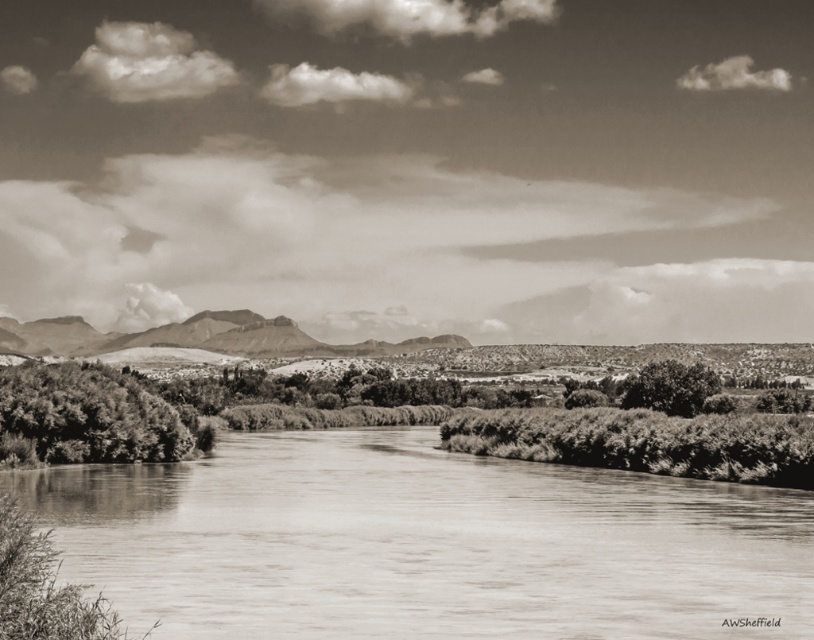
Question: Does smooth water at center have a lesser width compared to thick foliage at left?

Choices:
 (A) yes
 (B) no

Answer: (B)

Question: Which point is closer to the camera taking this photo?

Choices:
 (A) (624, 403)
 (B) (191, 438)

Answer: (B)

Question: Considering the real-world distances, which object is farthest from the thick foliage at left?

Choices:
 (A) grainy textured bush at right
 (B) smooth water at center

Answer: (A)

Question: Can you confirm if smooth water at center is thinner than rugged stone mountain at center?

Choices:
 (A) no
 (B) yes

Answer: (B)

Question: Among these objects, which one is farthest from the camera?

Choices:
 (A) rugged stone mountain at center
 (B) smooth water at center

Answer: (A)

Question: Does smooth water at center have a lesser width compared to grainy textured bush at right?

Choices:
 (A) yes
 (B) no

Answer: (B)